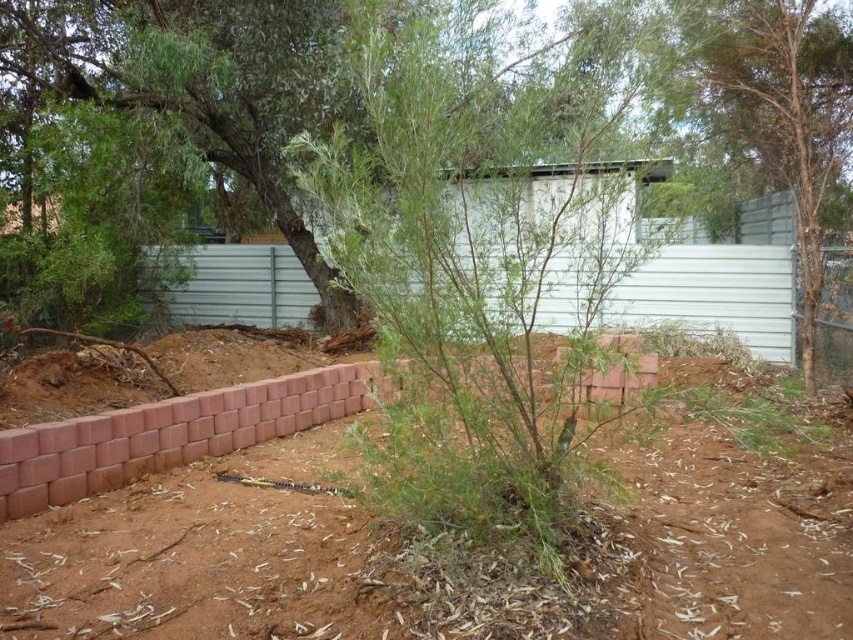
Question: Does green leafy tree at center appear on the right side of metallic silver fence at right?

Choices:
 (A) yes
 (B) no

Answer: (A)

Question: Can you confirm if green leafy bush at center is positioned above metallic silver fence at right?

Choices:
 (A) no
 (B) yes

Answer: (B)

Question: Among these objects, which one is nearest to the camera?

Choices:
 (A) green leafy tree at center
 (B) green leafy bush at center
 (C) metallic silver fence at right

Answer: (B)

Question: Which point is closer to the camera?

Choices:
 (A) (819, 81)
 (B) (721, 28)
 (C) (828, 346)

Answer: (C)

Question: Based on their relative distances, which object is farther from the green leafy tree at center?

Choices:
 (A) metallic silver fence at right
 (B) green leafy bush at center

Answer: (A)

Question: Is green leafy tree at center to the right of metallic silver fence at right from the viewer's perspective?

Choices:
 (A) yes
 (B) no

Answer: (A)